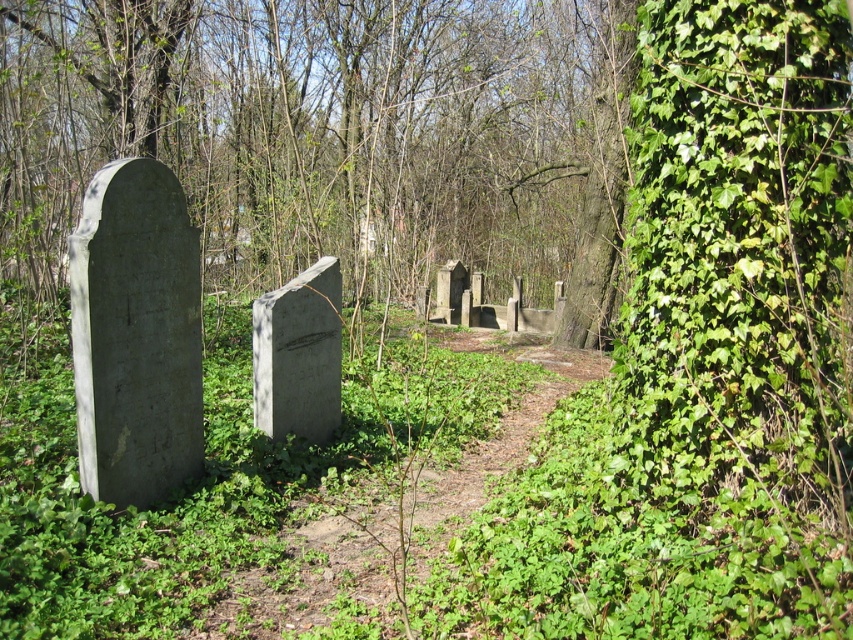
Question: Which is nearer to the gray stone gravestone at center?

Choices:
 (A) green ivy at right
 (B) gray stone gravestone at left

Answer: (B)

Question: Is green ivy at right thinner than gray stone gravestone at left?

Choices:
 (A) no
 (B) yes

Answer: (A)

Question: Can you confirm if green ivy at right is bigger than gray stone gravestone at left?

Choices:
 (A) yes
 (B) no

Answer: (A)

Question: Considering the real-world distances, which object is closest to the gray stone gravestone at left?

Choices:
 (A) gray stone gravestone at center
 (B) green ivy at right

Answer: (A)

Question: Is green ivy at right closer to camera compared to gray stone gravestone at left?

Choices:
 (A) yes
 (B) no

Answer: (B)

Question: Among these points, which one is farthest from the camera?

Choices:
 (A) (293, 388)
 (B) (180, 348)
 (C) (283, 125)

Answer: (C)